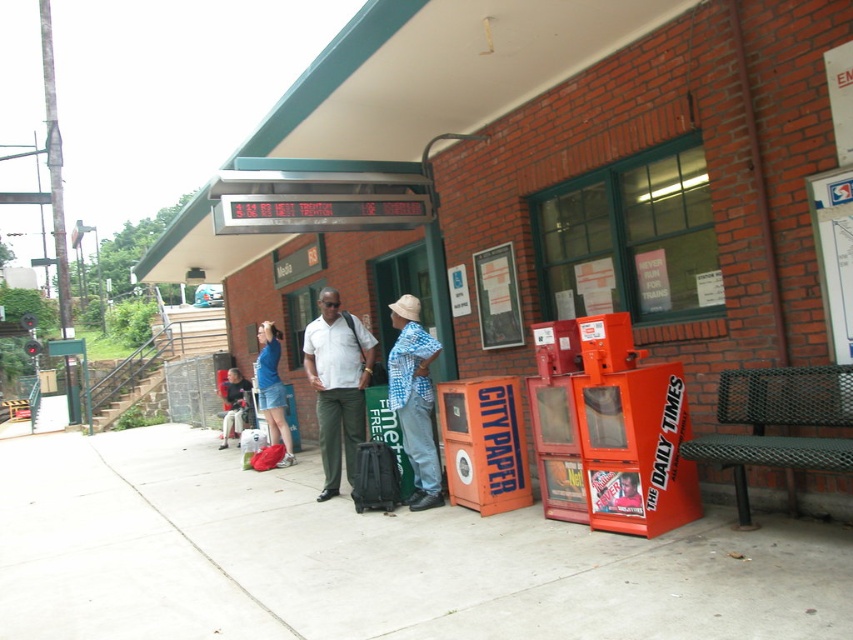
You are a photographer taking a picture of the matte black shirt at center and denim shorts at center. Which one will appear larger in the photo?

The matte black shirt at center will appear larger in the photo because it is taller than the denim shorts at center.

You are standing at the train station and want to take a photo of the two points mentioned. Which point, point (421,488) or point (274,400), will appear larger in your camera view?

Point (421,488) is closer to the camera than point (274,400), so it will appear larger in the camera view.

You are observing a person wearing a checkered fabric shirt at center and matte blue denim shorts at center. Which clothing item is shorter in height?

The checkered fabric shirt at center is not as tall as the matte blue denim shorts at center, so the checkered fabric shirt at center is shorter in height.